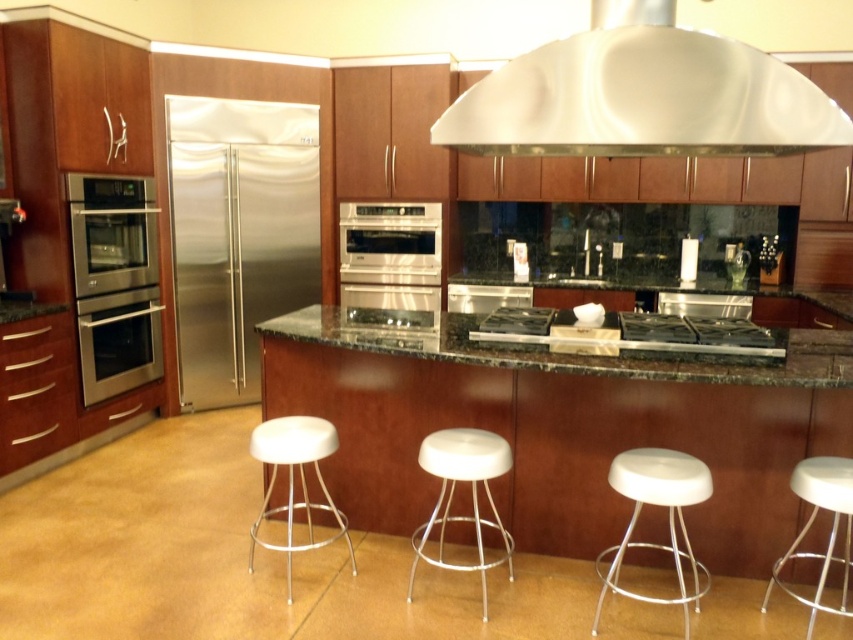
Question: Is satin silver exhaust hood at upper center to the right of stainless steel oven at center from the viewer's perspective?

Choices:
 (A) yes
 (B) no

Answer: (A)

Question: Does white plastic stool at lower right have a larger size compared to white plastic stool at center?

Choices:
 (A) no
 (B) yes

Answer: (B)

Question: Which is farther from the stainless steel oven at center?

Choices:
 (A) satin silver exhaust hood at upper center
 (B) white plastic stool at lower right
 (C) satin silver cooktop at center

Answer: (B)

Question: Which of these objects is positioned closest to the white plastic stool at lower right?

Choices:
 (A) white matte bar stool at lower left
 (B) white plastic bar stool at lower right

Answer: (B)

Question: Which of these objects is positioned farthest from the black glass cooktop at center?

Choices:
 (A) satin silver exhaust hood at upper center
 (B) black granite countertop at center
 (C) white plastic stool at center

Answer: (C)

Question: Is white plastic bar stool at lower right thinner than black glass cooktop at center?

Choices:
 (A) no
 (B) yes

Answer: (B)